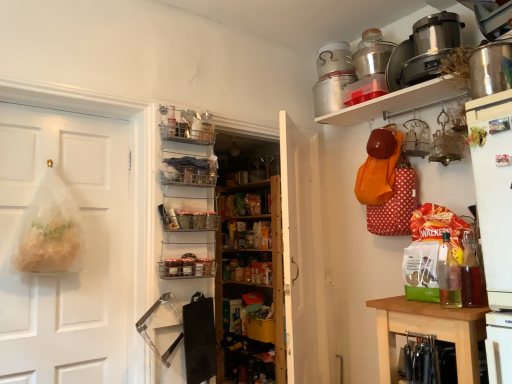
Question: Is shiny metallic pot at upper right, the 4th appliance positioned from the top, located outside wooden knife block at lower right?

Choices:
 (A) no
 (B) yes

Answer: (B)

Question: Is shiny metallic pot at upper right, arranged as the 4th appliance when viewed from the back, with wooden knife block at lower right?

Choices:
 (A) yes
 (B) no

Answer: (B)

Question: Is the position of shiny metallic pot at upper right, arranged as the 4th appliance when viewed from the back, less distant than that of wooden knife block at lower right?

Choices:
 (A) no
 (B) yes

Answer: (A)

Question: Can you confirm if shiny metallic pot at upper right, arranged as the 4th appliance when viewed from the back, is taller than wooden knife block at lower right?

Choices:
 (A) no
 (B) yes

Answer: (A)

Question: Is shiny metallic pot at upper right, arranged as the 4th appliance when viewed from the back, positioned with its back to wooden knife block at lower right?

Choices:
 (A) no
 (B) yes

Answer: (A)

Question: Considering the positions of metallic silver pot at upper right, positioned as the 1th appliance in top-to-bottom order, and shiny metallic pot at upper right, which is counted as the 2th appliance, starting from the bottom, in the image, is metallic silver pot at upper right, positioned as the 1th appliance in top-to-bottom order, wider or thinner than shiny metallic pot at upper right, which is counted as the 2th appliance, starting from the bottom,?

Choices:
 (A) thin
 (B) wide

Answer: (B)

Question: From their relative heights in the image, would you say metallic silver pot at upper right, which appears as the first appliance when viewed from the back, is taller or shorter than shiny metallic pot at upper right, which is counted as the 2th appliance, starting from the bottom?

Choices:
 (A) short
 (B) tall

Answer: (A)

Question: Looking at the image, does metallic silver pot at upper right, which appears as the first appliance when viewed from the back, seem bigger or smaller compared to shiny metallic pot at upper right, the 4th appliance positioned from the top?

Choices:
 (A) big
 (B) small

Answer: (A)

Question: From a real-world perspective, is metallic silver pot at upper right, the 5th appliance from the bottom, physically located above or below shiny metallic pot at upper right, placed as the second appliance when sorted from front to back?

Choices:
 (A) below
 (B) above

Answer: (B)

Question: Considering the positions of clear glass bottle at lower right, acting as the second bottle starting from the right, and clear plastic bag at left, which ranks as the second door in right-to-left order, in the image, is clear glass bottle at lower right, acting as the second bottle starting from the right, wider or thinner than clear plastic bag at left, which ranks as the second door in right-to-left order,?

Choices:
 (A) thin
 (B) wide

Answer: (A)

Question: Choose the correct answer: Is clear glass bottle at lower right, the 1th bottle in the left-to-right sequence, inside clear plastic bag at left, the first door in the left-to-right sequence, or outside it?

Choices:
 (A) inside
 (B) outside

Answer: (B)

Question: From the image's perspective, is clear glass bottle at lower right, the 1th bottle in the left-to-right sequence, located above or below clear plastic bag at left, the first door in the left-to-right sequence?

Choices:
 (A) above
 (B) below

Answer: (B)

Question: Considering the relative positions of clear glass bottle at lower right, the 1th bottle in the left-to-right sequence, and clear plastic bag at left, which ranks as the second door in right-to-left order, in the image provided, is clear glass bottle at lower right, the 1th bottle in the left-to-right sequence, to the left or to the right of clear plastic bag at left, which ranks as the second door in right-to-left order,?

Choices:
 (A) right
 (B) left

Answer: (A)

Question: Based on their sizes in the image, would you say metallic silver pot at upper right, the fourth appliance when ordered from front to back, is bigger or smaller than metallic wire baskets at center, which is counted as the first shelf, starting from the top?

Choices:
 (A) small
 (B) big

Answer: (B)

Question: Choose the correct answer: Is metallic silver pot at upper right, the 3th appliance from the top, inside metallic wire baskets at center, the 2th shelf ordered from the bottom, or outside it?

Choices:
 (A) inside
 (B) outside

Answer: (B)